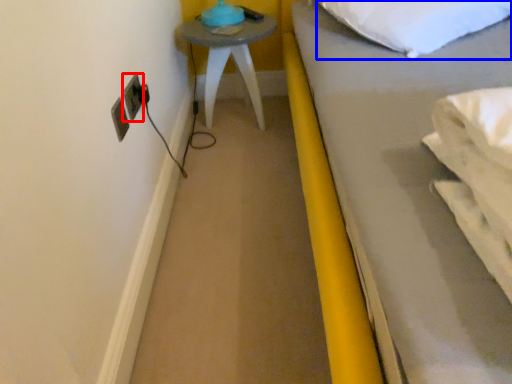
Question: Which of the following is the farthest to the observer, electric outlet (highlighted by a red box) or pillow (highlighted by a blue box)?

Choices:
 (A) electric outlet
 (B) pillow

Answer: (A)